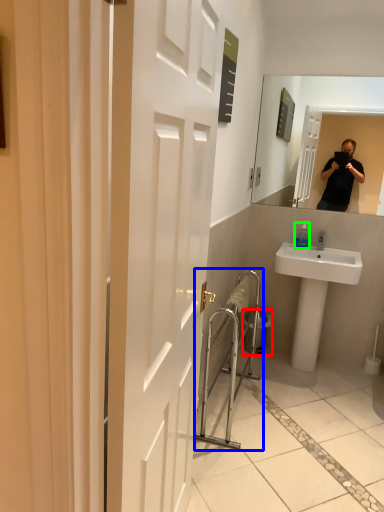
Question: Estimate the real-world distances between objects in this image. Which object is closer to trash bin/can (highlighted by a red box), balustrade (highlighted by a blue box) or bottle (highlighted by a green box)?

Choices:
 (A) balustrade
 (B) bottle

Answer: (A)